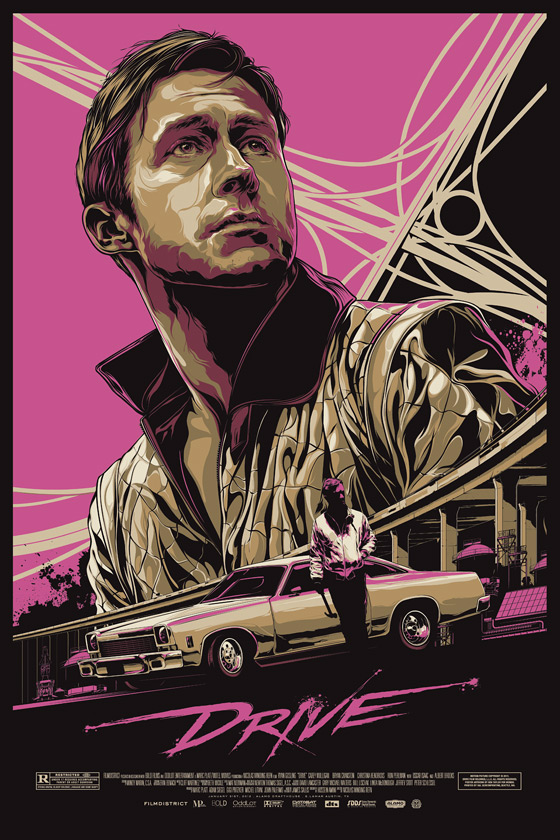
The width and height of the screenshot is (560, 840). I want to click on columns, so click(x=507, y=513), click(x=529, y=523), click(x=444, y=539), click(x=399, y=552).